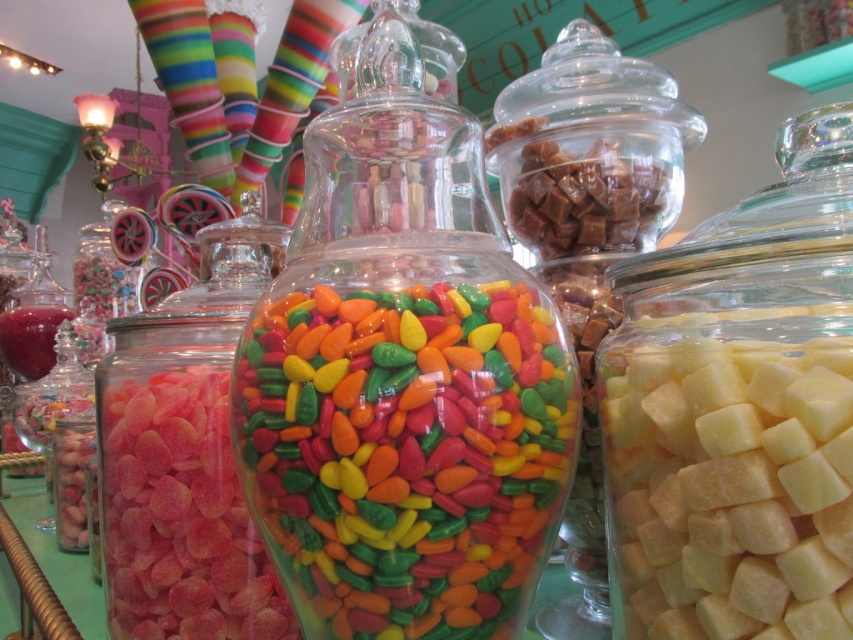
You are a customer at the candy shop and want to buy both the translucent glass cubes at right and the glossy pink gummy at center. If you want to place them side by side on your kitchen counter, which one will require more vertical space?

The translucent glass cubes at right has a greater height compared to the glossy pink gummy at center, so it will require more vertical space when placed side by side on the kitchen counter.

Looking at this image, you are a customer in the candy shop and want to reach both the point at (805, 352) and the point at (347, 301). Which point should you approach first to ensure you can see both points clearly?

You should approach the point at (347, 301) first because it is behind the point at (805, 352). By moving closer to the back point first, you can then step forward to see the front point without obstruction.

You are a customer at the candy shop and want to buy both the translucent glass cubes at right and the glossy pink gummy at center. Which of these two items is positioned higher up in the display?

The translucent glass cubes at right is located above the glossy pink gummy at center, so it is positioned higher up in the display.